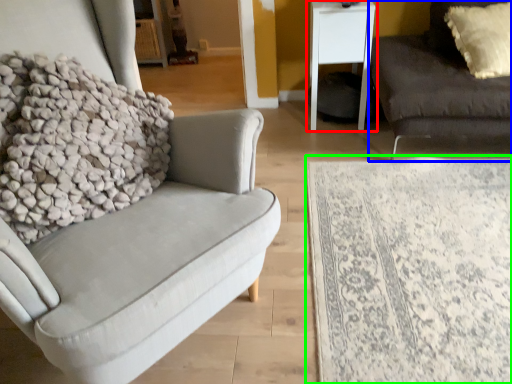
Question: Estimate the real-world distances between objects in this image. Which object is closer to table (highlighted by a red box), studio couch (highlighted by a blue box) or plain (highlighted by a green box)?

Choices:
 (A) studio couch
 (B) plain

Answer: (A)